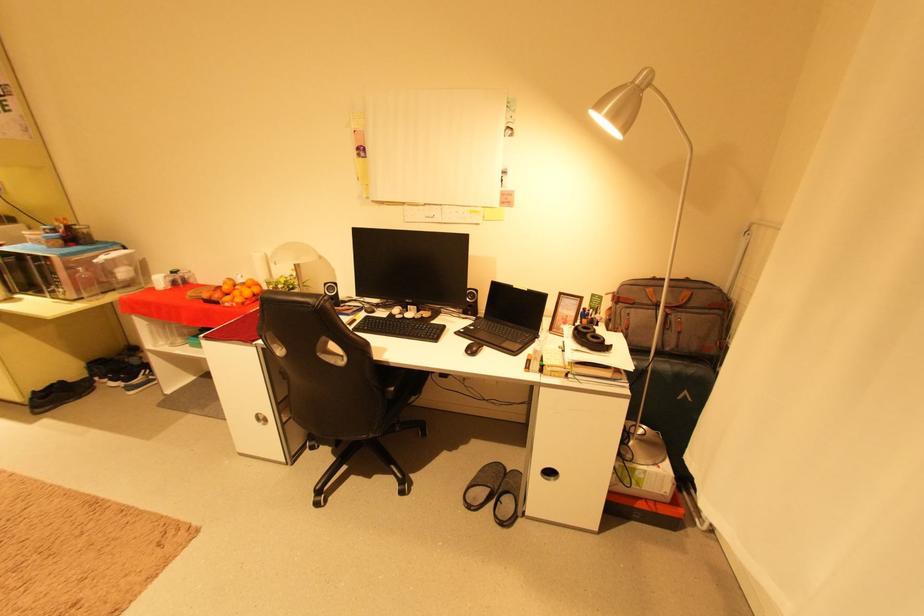
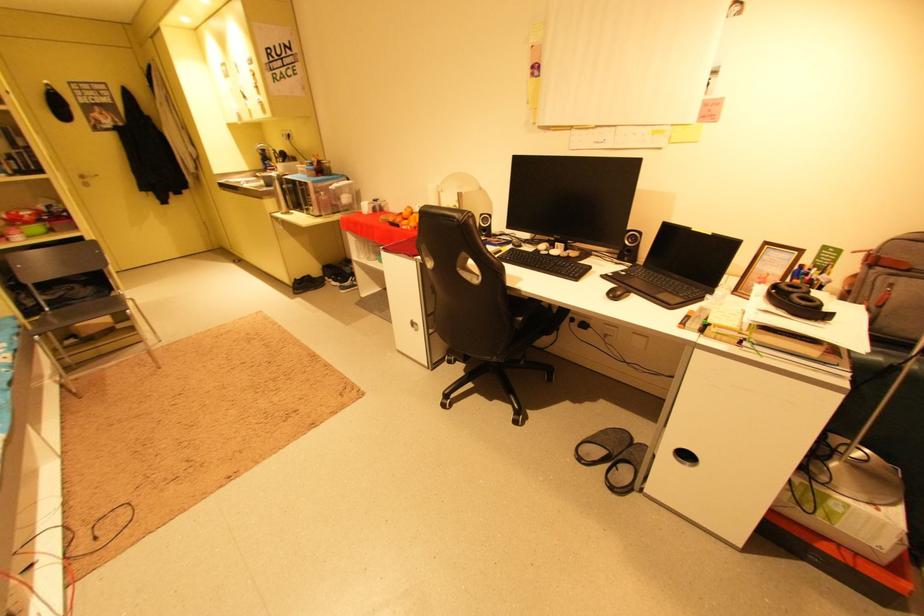
The images are taken continuously from a first-person perspective. In which direction are you moving?

The cameraman moved toward right, forward.